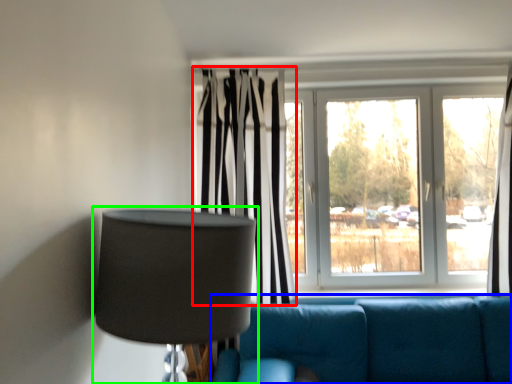
Question: Considering the real-world distances, which object is farthest from curtain (highlighted by a red box)? studio couch (highlighted by a blue box) or lamp (highlighted by a green box)?

Choices:
 (A) studio couch
 (B) lamp

Answer: (B)